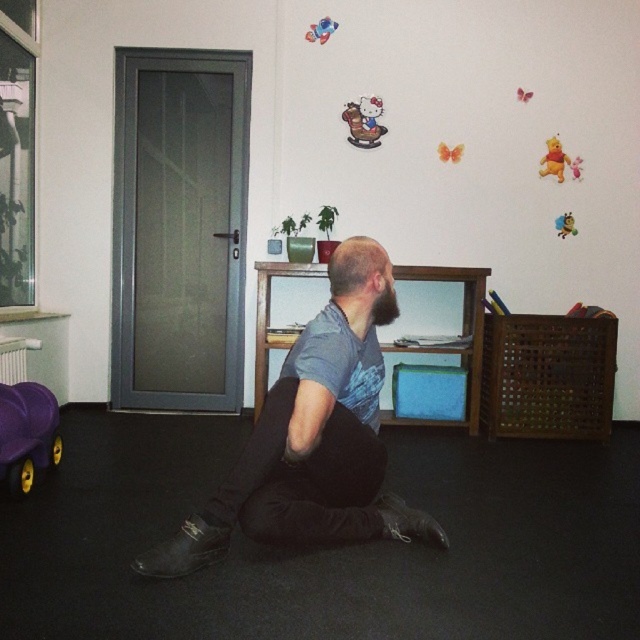
Is point (339, 364) farther from camera compared to point (554, 227)?

That is False.

Who is more distant from viewer, (305, 387) or (554, 228)?

The point (554, 228) is more distant.

Locate an element on the screen. dark gray fabric pants at center is located at coordinates (312, 436).

The height and width of the screenshot is (640, 640). Identify the location of velvet winnie the pooh at upper right. click(x=554, y=161).

Is point (545, 161) less distant than point (561, 230)?

Yes, it is in front of point (561, 230).

Where is `velvet winnie the pooh at upper right`? velvet winnie the pooh at upper right is located at coordinates point(554,161).

Does purple rubber toy car at lower left lie in front of matte plastic rocking horse at upper center?

That is True.

Measure the distance between purple rubber toy car at lower left and camera.

purple rubber toy car at lower left is 7.70 feet away from camera.

The height and width of the screenshot is (640, 640). What are the coordinates of `purple rubber toy car at lower left` in the screenshot? It's located at pyautogui.click(x=26, y=435).